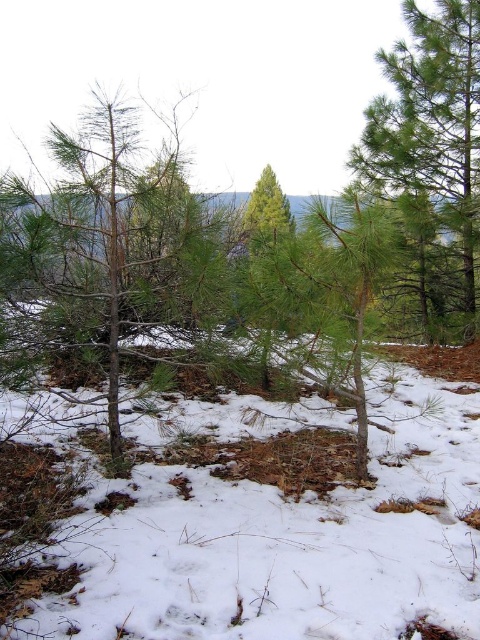
Consider the image. Does green needle-like tree at center appear on the left side of green needle-like at center?

Correct, you'll find green needle-like tree at center to the left of green needle-like at center.

Who is taller, green needle-like tree at center or green needle-like at center?

Standing taller between the two is green needle-like at center.

Which is behind, point (134, 260) or point (453, 42)?

Positioned behind is point (453, 42).

Image resolution: width=480 pixels, height=640 pixels. I want to click on green needle-like tree at center, so click(x=112, y=246).

Does point (49, 531) come farther from viewer compared to point (421, 65)?

No, it is not.

Which is in front, point (189, 401) or point (428, 125)?

Positioned in front is point (189, 401).

Image resolution: width=480 pixels, height=640 pixels. Identify the location of white fluffy snow at center. (249, 520).

Who is higher up, white fluffy snow at center or green needle-like tree at center?

green needle-like tree at center

Does white fluffy snow at center come behind green needle-like tree at center?

No, white fluffy snow at center is closer to the viewer.

Is point (287, 624) positioned after point (56, 202)?

That is False.

Identify the location of white fluffy snow at center. pyautogui.click(x=249, y=520).